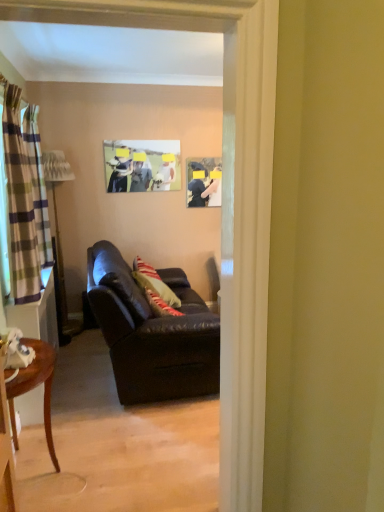
Locate an element on the screen. free spot behind mahogany wood side table at lower left is located at coordinates (82, 429).